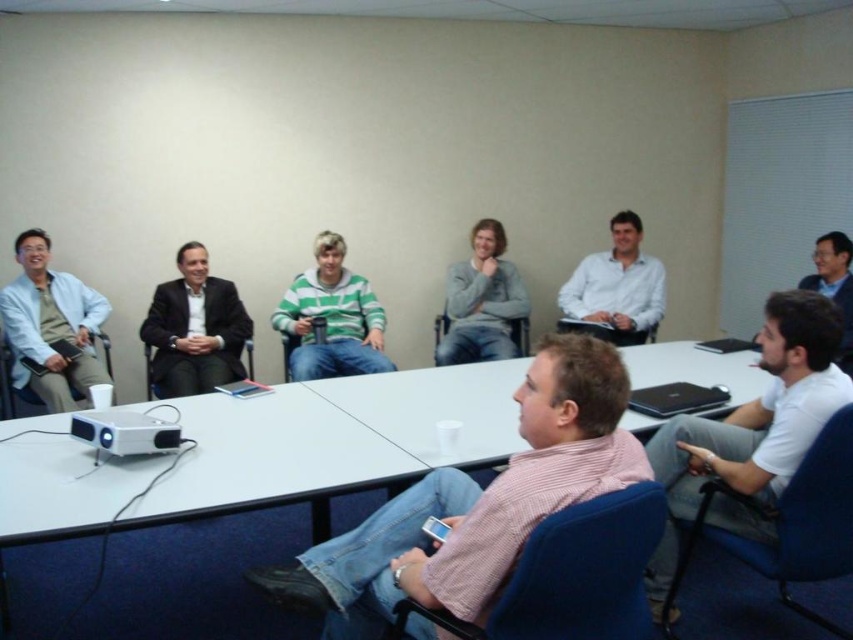
You are a guest entering the meeting room and see the dark suit jacket at center and the black fabric chair at center. Which object is on top of the other?

The dark suit jacket at center is positioned over the black fabric chair at center, so the dark suit jacket is on top of the black fabric chair.

You are sitting at the rectangular white table in the meeting room. You notice two points marked on the table. The first point is at coordinate [788,502] and the second point is at coordinate [6,339]. If you are facing the projector, which point is closer to you?

Point [788,502] is in front of point [6,339], so if you are facing the projector, point [788,502] is closer to you.

You are a person who is 1.7 meters tall and standing at the camera position. You want to sit down in the blue fabric chair at lower right. Can you safely reach the chair without bending over?

The blue fabric chair at lower right is 1.93 meters from camera. Since you are 1.7 meters tall, your maximum reach height is approximately 2.2 meters. The distance to the chair is within your reach range, so you can safely reach the chair without bending over.